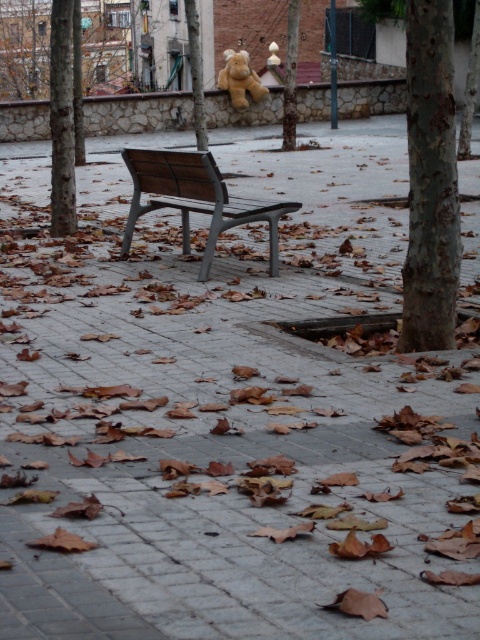
You are a park visitor who wants to place a picnic basket on the wooden bench at center without disturbing the soft plush bear at upper center. Since the bench is empty, where should you put the basket?

The wooden bench at center is below the soft plush bear at upper center, so placing the picnic basket on the bench itself would not disturb the bear as it is positioned higher up on the wall.

You are standing in the plaza and want to take a photo of both the rough bark tree at right and the smooth brown tree trunk at left. Which tree should you stand closer to in order to capture both in the same frame?

You should stand closer to the smooth brown tree trunk at left because the rough bark tree at right is positioned on the right side of it, meaning both are aligned horizontally. By positioning yourself near the left tree, you can more easily include both in your camera frame.